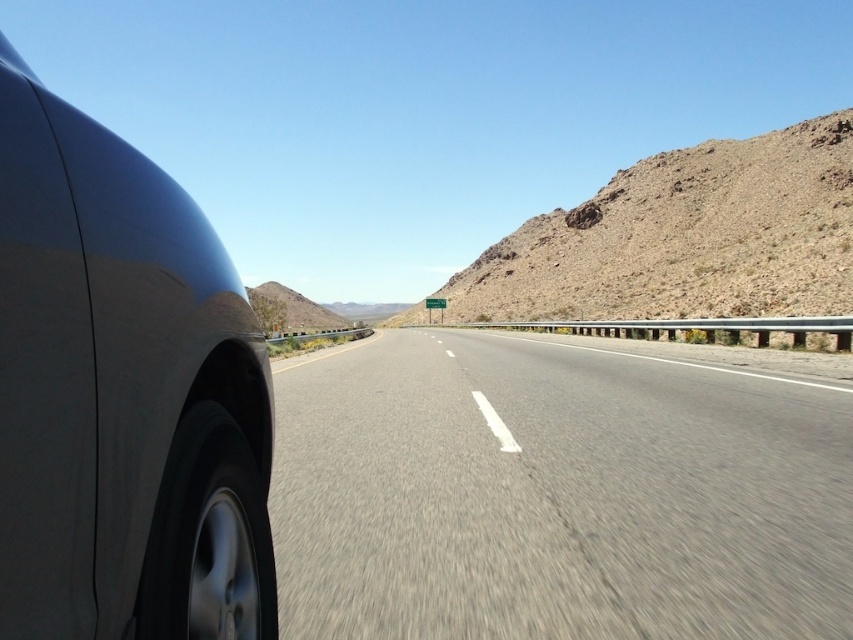
Does satin metallic car at left appear under brown rocky mountain at center?

Indeed, satin metallic car at left is positioned under brown rocky mountain at center.

Is point (73, 173) positioned in front of point (252, 291)?

Yes, point (73, 173) is in front of point (252, 291).

At what (x,y) coordinates should I click in order to perform the action: click on satin metallic car at left. Please return your answer as a coordinate pair (x, y). The height and width of the screenshot is (640, 853). Looking at the image, I should click on (122, 394).

Can you confirm if asphalt road at center is wider than satin metallic car at left?

In fact, asphalt road at center might be narrower than satin metallic car at left.

Which is below, asphalt road at center or satin metallic car at left?

asphalt road at center

Where is `asphalt road at center`? This screenshot has height=640, width=853. asphalt road at center is located at coordinates (556, 496).

Does asphalt road at center appear on the right side of brown rocky mountain at upper right?

No, asphalt road at center is not to the right of brown rocky mountain at upper right.

Between asphalt road at center and brown rocky mountain at upper right, which one is positioned lower?

Positioned lower is asphalt road at center.

Is point (393, 564) positioned before point (724, 278)?

Yes, point (393, 564) is closer to viewer.

At what (x,y) coordinates should I click in order to perform the action: click on asphalt road at center. Please return your answer as a coordinate pair (x, y). The image size is (853, 640). Looking at the image, I should click on (556, 496).